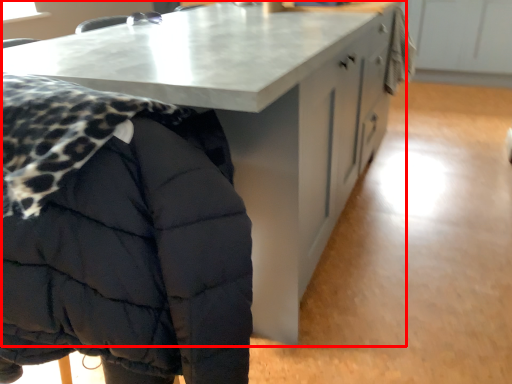
Question: Observing the image, what is the correct spatial positioning of table (annotated by the red box) in reference to jacket?

Choices:
 (A) right
 (B) left

Answer: (A)